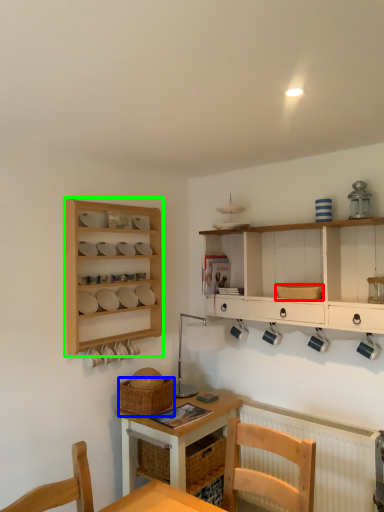
Question: Estimate the real-world distances between objects in this image. Which object is farther from basket (highlighted by a red box), basket (highlighted by a blue box) or shelf (highlighted by a green box)?

Choices:
 (A) basket
 (B) shelf

Answer: (B)